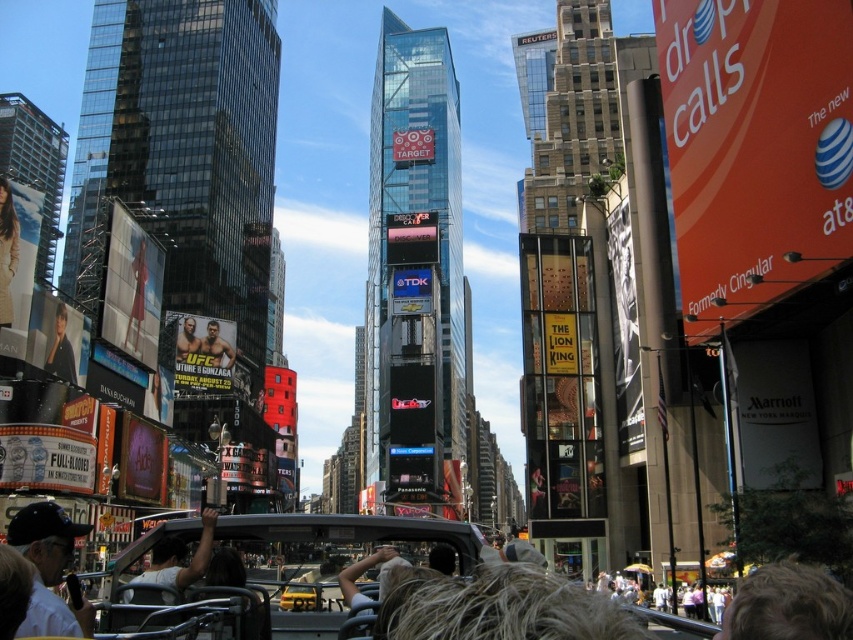
Does matte black jacket at upper left have a greater width compared to yellow matte taxi at center?

In fact, matte black jacket at upper left might be narrower than yellow matte taxi at center.

Who is positioned more to the left, matte black jacket at upper left or yellow matte taxi at center?

matte black jacket at upper left is more to the left.

Where is `matte black jacket at upper left`? This screenshot has height=640, width=853. matte black jacket at upper left is located at coordinates (7, 250).

Consider the image. Between black leather jacket at left and muscular man in fighting attire at center, which one has less height?

black leather jacket at left

Which is in front, point (73, 362) or point (230, 365)?

Positioned in front is point (73, 362).

Between point (73, 371) and point (210, 352), which one is positioned in front?

Point (73, 371) is in front.

Find the location of a particular element. black leather jacket at left is located at coordinates (61, 349).

Between point (759, 595) and point (279, 600), which one is positioned in front?

Positioned in front is point (759, 595).

Who is more distant from viewer, (x=780, y=637) or (x=302, y=592)?

Positioned behind is point (x=302, y=592).

This screenshot has width=853, height=640. What are the coordinates of `blonde hair at lower right` in the screenshot? It's located at (788, 605).